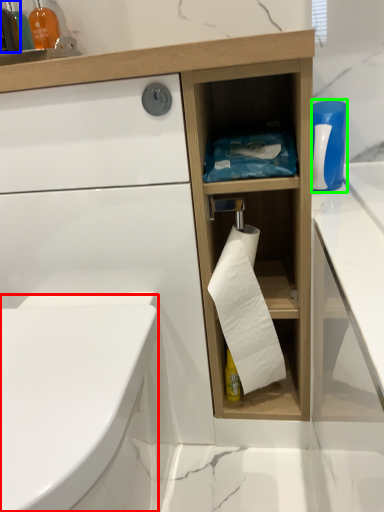
Question: Based on their relative distances, which object is farther from bidet (highlighted by a red box)? Choose from bottle (highlighted by a blue box) and cleaning product (highlighted by a green box).

Choices:
 (A) bottle
 (B) cleaning product

Answer: (A)